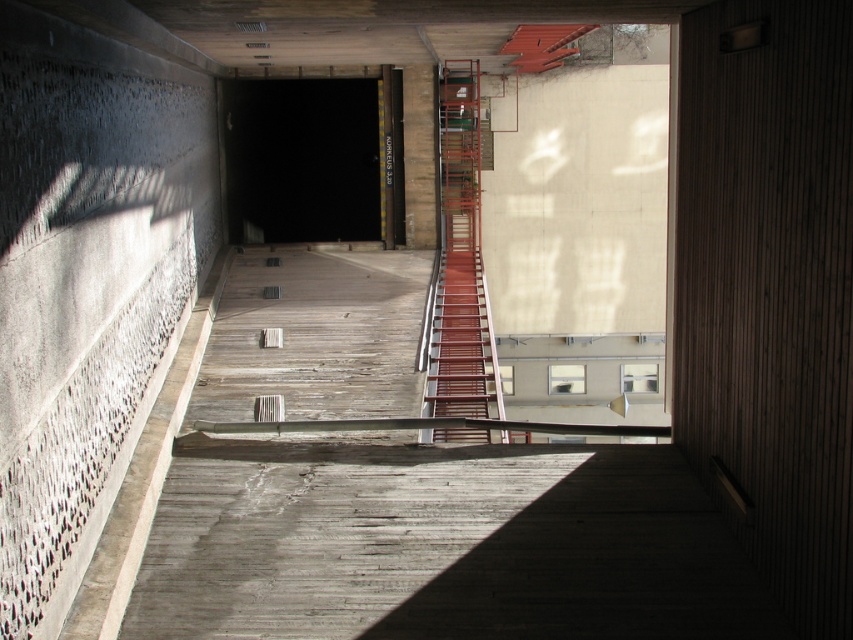
Question: Does black matte tunnel at center have a greater width compared to metallic red staircase at center?

Choices:
 (A) yes
 (B) no

Answer: (B)

Question: Is black matte tunnel at center further to the viewer compared to metallic red staircase at center?

Choices:
 (A) yes
 (B) no

Answer: (A)

Question: Which point appears farthest from the camera in this image?

Choices:
 (A) (473, 234)
 (B) (225, 136)

Answer: (A)

Question: Is black matte tunnel at center above metallic red staircase at center?

Choices:
 (A) no
 (B) yes

Answer: (B)